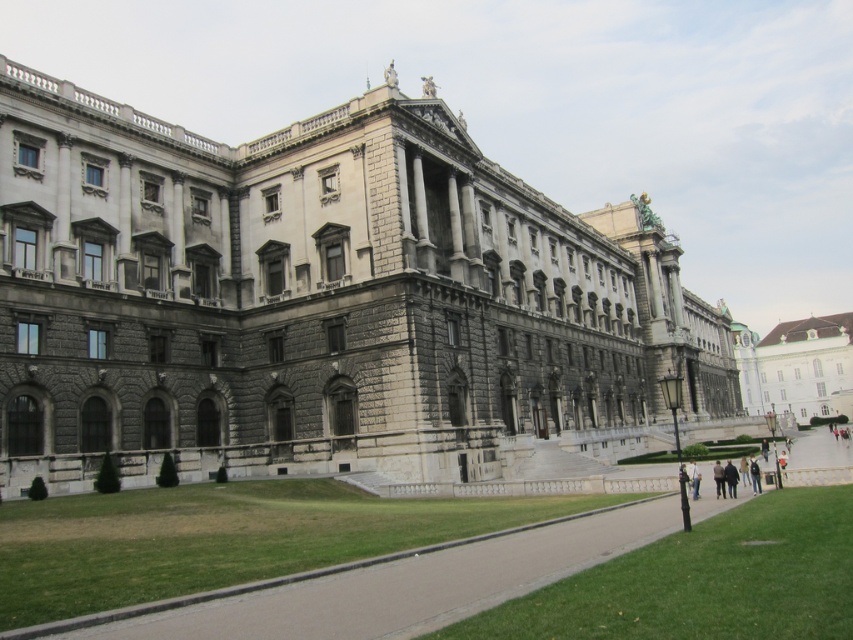
You are standing at the entrance of the grand neoclassical building and want to walk towards the statue located at point (x=721, y=467). There is another statue at point (x=595, y=397). Which statue will you see first as you walk towards the first one?

You will see the statue at point (x=721, y=467) first because it is closer to you than the statue at point (x=595, y=397), which is further behind.